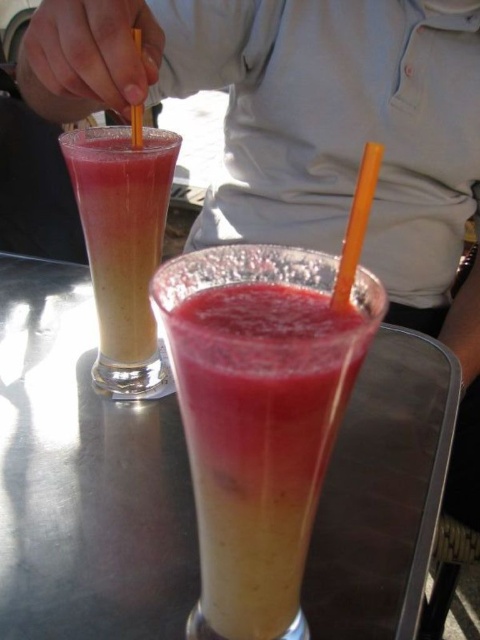
Does translucent glass juice at left have a smaller size compared to orange plastic straw at upper center?

Incorrect, translucent glass juice at left is not smaller in size than orange plastic straw at upper center.

What do you see at coordinates (121, 228) in the screenshot? The image size is (480, 640). I see `translucent glass juice at left` at bounding box center [121, 228].

In order to click on translucent glass juice at left in this screenshot , I will do `click(121, 228)`.

Based on the photo, between translucent glass at center and translucent glass juice at left, which one is positioned higher?

translucent glass juice at left is above.

How far apart are translucent glass at center and translucent glass juice at left?

translucent glass at center and translucent glass juice at left are 5.67 inches apart.

This screenshot has width=480, height=640. I want to click on translucent glass at center, so click(84, 477).

Find the location of a particular element. This screenshot has height=640, width=480. translucent glass at center is located at coordinates (84, 477).

Is smooth matte juice at center closer to camera compared to translucent glass juice at left?

Yes, smooth matte juice at center is in front of translucent glass juice at left.

Looking at this image, who is higher up, smooth matte juice at center or translucent glass juice at left?

translucent glass juice at left

Who is more distant from viewer, (243, 376) or (158, 218)?

Point (158, 218)

At what (x,y) coordinates should I click in order to perform the action: click on smooth matte juice at center. Please return your answer as a coordinate pair (x, y). The height and width of the screenshot is (640, 480). Looking at the image, I should click on (260, 438).